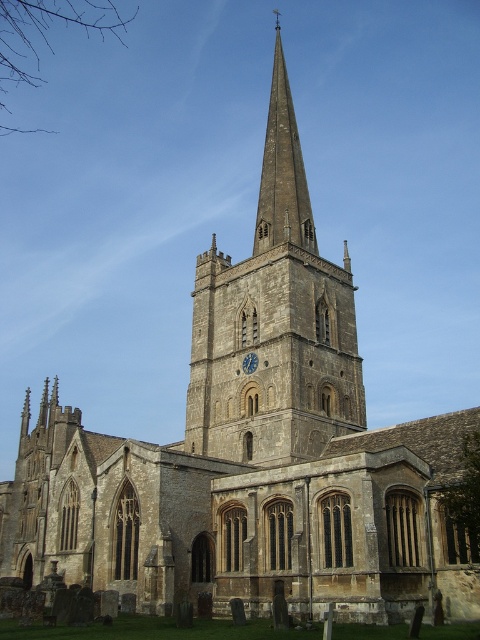
Is stone steeple at center bigger than blue painted wood clock at center?

Yes.

In the scene shown: Can you confirm if stone steeple at center is positioned to the right of blue painted wood clock at center?

Indeed, stone steeple at center is positioned on the right side of blue painted wood clock at center.

Does point (303, 269) come in front of point (249, 356)?

No.

You are a GUI agent. You are given a task and a screenshot of the screen. Output one action in this format:
    pyautogui.click(x=<x>, y=<y>)
    Task: Click on the stone steeple at center
    This screenshot has width=480, height=640.
    Given the screenshot: What is the action you would take?
    pyautogui.click(x=274, y=323)